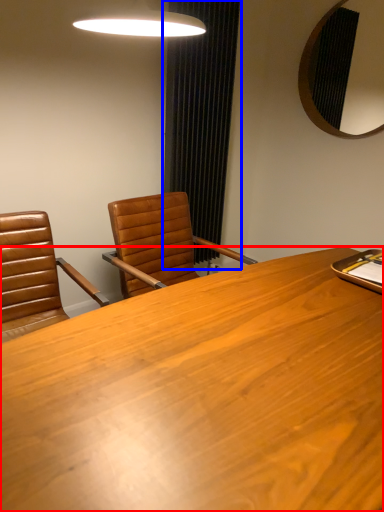
Question: Which of the following is the farthest to the observer, desk (highlighted by a red box) or curtain (highlighted by a blue box)?

Choices:
 (A) desk
 (B) curtain

Answer: (B)